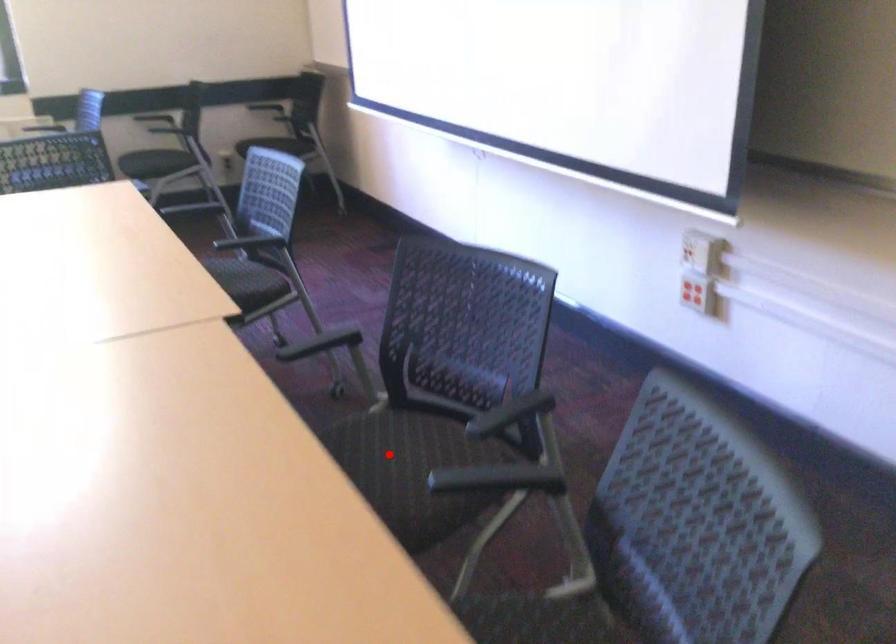
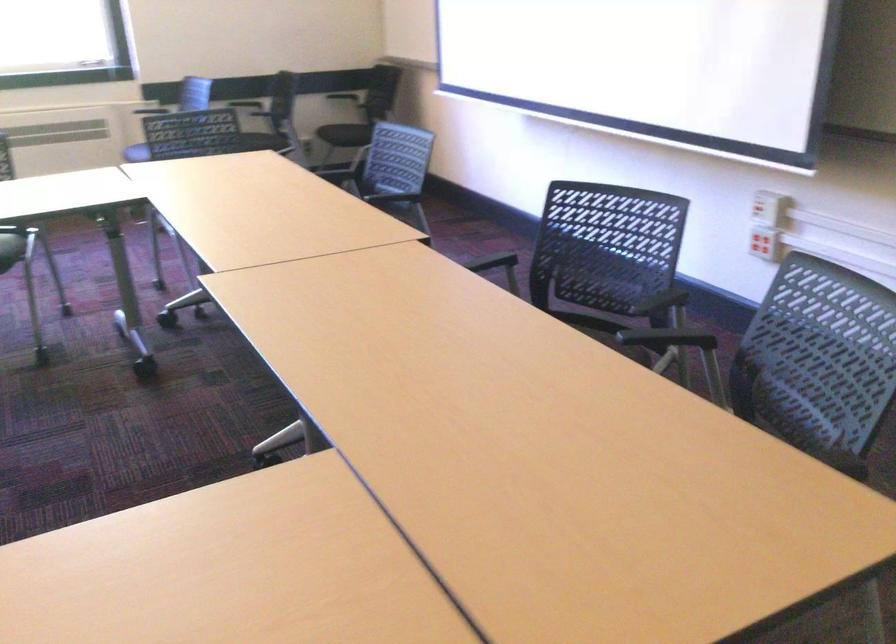
Question: I am providing you with two images of the same scene from different viewpoints. A red point is marked on the first image. Can you still see the location of the red point in image 2?

Choices:
 (A) Yes
 (B) No

Answer: (B)